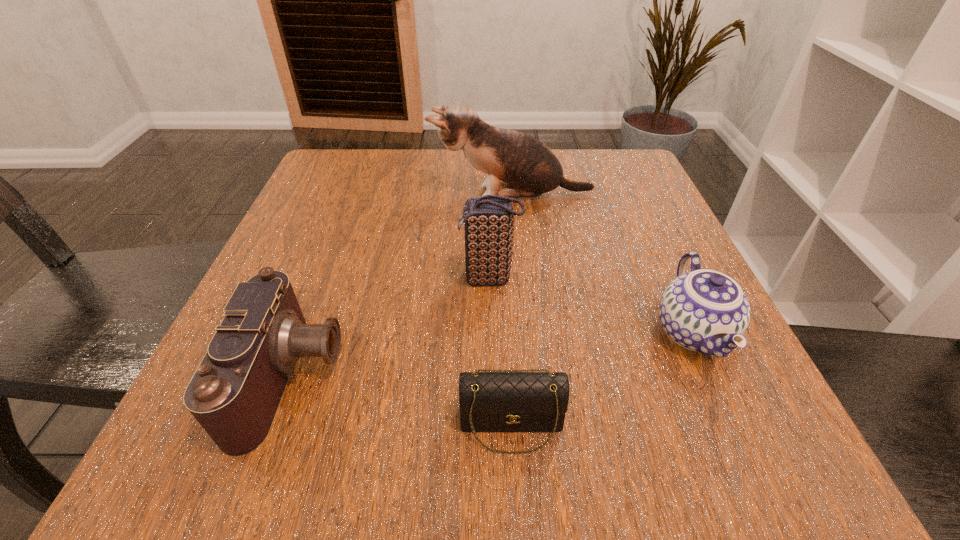
At what (x,y) coordinates should I click in order to perform the action: click on chinaware situated at the right edge. Please return your answer as a coordinate pair (x, y). The width and height of the screenshot is (960, 540). Looking at the image, I should click on (704, 310).

Locate an element on the screen. Image resolution: width=960 pixels, height=540 pixels. object situated at the near left corner is located at coordinates (236, 390).

Where is `object that is at the far right corner`? The image size is (960, 540). object that is at the far right corner is located at coordinates (528, 168).

Where is `vacant region at the far edge of the desktop`? The height and width of the screenshot is (540, 960). vacant region at the far edge of the desktop is located at coordinates (430, 188).

Where is `vacant area at the near edge`? vacant area at the near edge is located at coordinates (588, 458).

Where is `blank space at the left edge`? The height and width of the screenshot is (540, 960). blank space at the left edge is located at coordinates (289, 226).

In the image, there is a desktop. Identify the location of vacant area at the right edge. This screenshot has height=540, width=960. (660, 228).

At what (x,y) coordinates should I click in order to perform the action: click on vacant region at the far left corner of the desktop. Please return your answer as a coordinate pair (x, y). The height and width of the screenshot is (540, 960). Looking at the image, I should click on (352, 170).

Where is `vacant area at the far right corner of the desktop`? This screenshot has width=960, height=540. vacant area at the far right corner of the desktop is located at coordinates (598, 189).

Find the location of a particular element. free spot between the chinaware and the taller clutch bag is located at coordinates (591, 306).